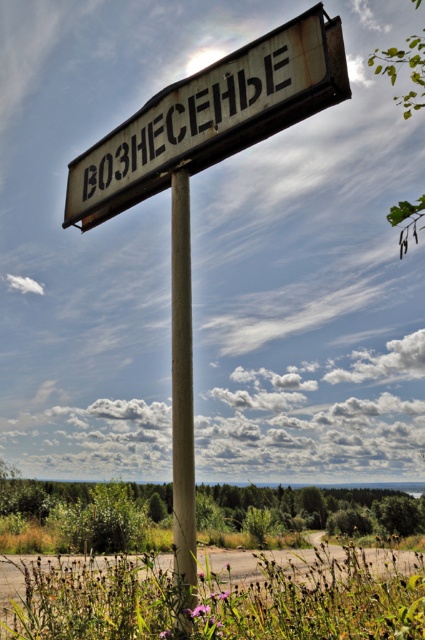
Can you confirm if rusty metal sign at upper center is positioned below rusty metal pole at center?

No.

Which is more to the right, rusty metal sign at upper center or rusty metal pole at center?

rusty metal pole at center

Does point (138, 134) lie behind point (181, 442)?

Yes, it is behind point (181, 442).

Identify the location of rusty metal sign at upper center. (212, 116).